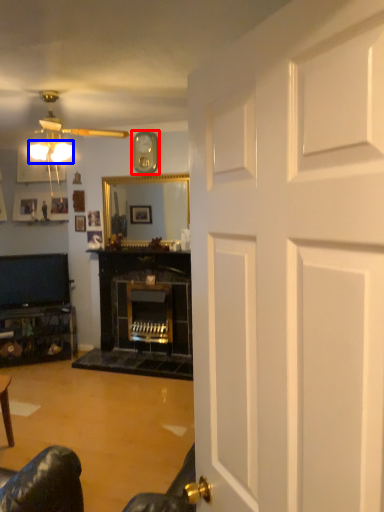
Question: Which object is further to the camera taking this photo, clock (highlighted by a red box) or lamp (highlighted by a blue box)?

Choices:
 (A) clock
 (B) lamp

Answer: (A)